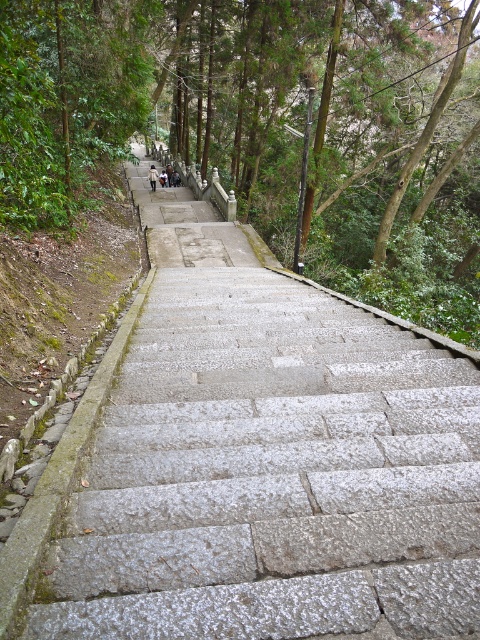
You are standing at the bottom of the gray stone stairs at center and want to reach the point marked as point (x=272, y=476). Which direction should you move to get there?

The point (x=272, y=476) is located on the gray stone stairs at center, so you should move upward along the gray stone stairs at center to reach it.

You are a hiker carrying a heavy backpack and want to climb the gray stone stairs at center and the dark gray stone steps at upper center. How far apart are these two sections of the staircase?

The gray stone stairs at center is 26.12 meters from dark gray stone steps at upper center.

You are standing at the bottom of the stone staircase and want to take a photo that includes both point (x=140, y=484) and point (x=153, y=184). Which point should you focus on to ensure both are in sharp focus?

You should focus on point (x=153, y=184) because it is farther from the camera, and focusing on the farther point will keep both points in focus due to the depth of field.